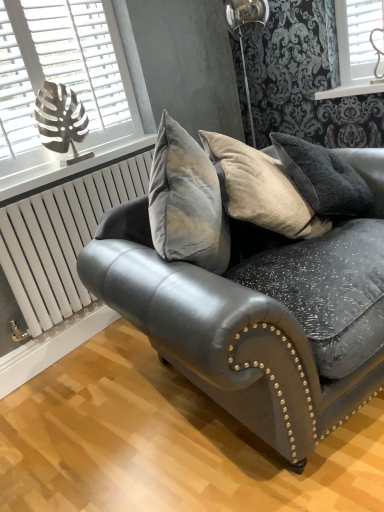
Describe the element at coordinates (352, 90) in the screenshot. I see `white painted wood at upper center` at that location.

I want to click on white metallic radiator at lower left, so click(x=62, y=234).

Identify the location of metallic leaf-shaped object at upper left. The image size is (384, 512). (61, 121).

From a real-world perspective, which object rests below the other?

In real-world perspective, white painted wood at upper center is lower.

Is white painted wood at upper center aimed at metallic silver leaf at upper left?

No, white painted wood at upper center is not facing towards metallic silver leaf at upper left.

Is white painted wood at upper center to the right of metallic silver leaf at upper left from the viewer's perspective?

Yes.

Considering the relative sizes of white painted wood at upper center and metallic silver leaf at upper left in the image provided, is white painted wood at upper center shorter than metallic silver leaf at upper left?

Correct, white painted wood at upper center is not as tall as metallic silver leaf at upper left.

Between point (75, 116) and point (77, 297), which one is positioned behind?

The point (77, 297) is behind.

From the image's perspective, is metallic leaf-shaped object at upper left located beneath white metallic radiator at lower left?

No.

Can you confirm if metallic leaf-shaped object at upper left is positioned to the right of white metallic radiator at lower left?

No, metallic leaf-shaped object at upper left is not to the right of white metallic radiator at lower left.

Is metallic silver leaf at upper left not inside white metallic radiator at lower left?

Yes.

Which is in front, metallic silver leaf at upper left or white metallic radiator at lower left?

Positioned in front is metallic silver leaf at upper left.

Is metallic silver leaf at upper left looking in the opposite direction of white metallic radiator at lower left?

No, metallic silver leaf at upper left's orientation is not away from white metallic radiator at lower left.

Is white painted wood at upper center directly adjacent to metallic leaf-shaped object at upper left?

No, white painted wood at upper center is not in contact with metallic leaf-shaped object at upper left.

Does white painted wood at upper center have a lesser width compared to metallic leaf-shaped object at upper left?

No.

From a real-world perspective, is white painted wood at upper center physically above metallic leaf-shaped object at upper left?

No.

From a real-world perspective, who is located higher, velvet grey couch at center or metallic leaf-shaped object at upper left?

From a 3D spatial view, metallic leaf-shaped object at upper left is above.

Is velvet grey couch at center looking in the opposite direction of metallic leaf-shaped object at upper left?

velvet grey couch at center does not have its back to metallic leaf-shaped object at upper left.

Which of these two, velvet grey couch at center or metallic leaf-shaped object at upper left, stands taller?

velvet grey couch at center is taller.

Is velvet grey couch at center next to metallic leaf-shaped object at upper left?

velvet grey couch at center is not next to metallic leaf-shaped object at upper left, and they're not touching.

Is metallic silver leaf at upper left not inside metallic leaf-shaped object at upper left?

Absolutely, metallic silver leaf at upper left is external to metallic leaf-shaped object at upper left.

How distant is metallic silver leaf at upper left from metallic leaf-shaped object at upper left?

They are 6.23 inches apart.

Based on their positions, is metallic silver leaf at upper left located to the left or right of metallic leaf-shaped object at upper left?

metallic silver leaf at upper left is to the left of metallic leaf-shaped object at upper left.

Does point (97, 100) appear closer or farther from the camera than point (38, 114)?

Point (97, 100).

Which is closer, (x=42, y=78) or (x=338, y=93)?

Point (x=42, y=78)

Which object is wider, metallic silver leaf at upper left or white painted wood at upper center?

white painted wood at upper center.

Considering the relative sizes of metallic silver leaf at upper left and white painted wood at upper center in the image provided, is metallic silver leaf at upper left shorter than white painted wood at upper center?

Incorrect, the height of metallic silver leaf at upper left does not fall short of that of white painted wood at upper center.

From the image's perspective, is metallic silver leaf at upper left located above or below white painted wood at upper center?

Based on their image positions, metallic silver leaf at upper left is located beneath white painted wood at upper center.

This screenshot has width=384, height=512. Identify the location of window sill beneath the metallic silver leaf at upper left (from a real-world perspective). coord(352,90).

Image resolution: width=384 pixels, height=512 pixels. What are the coordinates of `radiator that is below the metallic leaf-shaped object at upper left (from the image's perspective)` in the screenshot? It's located at (62, 234).

From the image, which object appears to be farther from metallic leaf-shaped object at upper left, white painted wood at upper center or metallic silver leaf at upper left?

The object further to metallic leaf-shaped object at upper left is white painted wood at upper center.

From the picture: Based on their spatial positions, is white painted wood at upper center or metallic silver leaf at upper left closer to white metallic radiator at lower left?

metallic silver leaf at upper left lies closer to white metallic radiator at lower left than the other object.

Which object lies nearer to the anchor point velvet grey couch at center, white metallic radiator at lower left or metallic silver leaf at upper left?

Among the two, white metallic radiator at lower left is located nearer to velvet grey couch at center.

Based on their spatial positions, is white painted wood at upper center or velvet grey couch at center further from white metallic radiator at lower left?

Based on the image, white painted wood at upper center appears to be further to white metallic radiator at lower left.

Considering their positions, is metallic leaf-shaped object at upper left positioned further to velvet grey couch at center than metallic silver leaf at upper left?

metallic silver leaf at upper left lies further to velvet grey couch at center than the other object.

From the image, which object appears to be nearer to white painted wood at upper center, velvet grey couch at center or metallic leaf-shaped object at upper left?

metallic leaf-shaped object at upper left is positioned closer to the anchor white painted wood at upper center.

Looking at the image, which one is located closer to metallic leaf-shaped object at upper left, metallic silver leaf at upper left or white painted wood at upper center?

metallic silver leaf at upper left is positioned closer to the anchor metallic leaf-shaped object at upper left.

In the scene shown: Estimate the real-world distances between objects in this image. Which object is further from metallic silver leaf at upper left, metallic leaf-shaped object at upper left or white metallic radiator at lower left?

The object further to metallic silver leaf at upper left is white metallic radiator at lower left.

This screenshot has height=512, width=384. Find the location of `studio couch between metallic leaf-shaped object at upper left and white painted wood at upper center in the horizontal direction`. studio couch between metallic leaf-shaped object at upper left and white painted wood at upper center in the horizontal direction is located at coordinates (250, 309).

Find the location of a particular element. This screenshot has height=512, width=384. radiator situated between metallic silver leaf at upper left and velvet grey couch at center from left to right is located at coordinates (62, 234).

Where is `table lamp between metallic silver leaf at upper left and white painted wood at upper center`? This screenshot has height=512, width=384. table lamp between metallic silver leaf at upper left and white painted wood at upper center is located at coordinates (61, 121).

Identify the location of radiator between metallic leaf-shaped object at upper left and white painted wood at upper center. This screenshot has height=512, width=384. (62, 234).